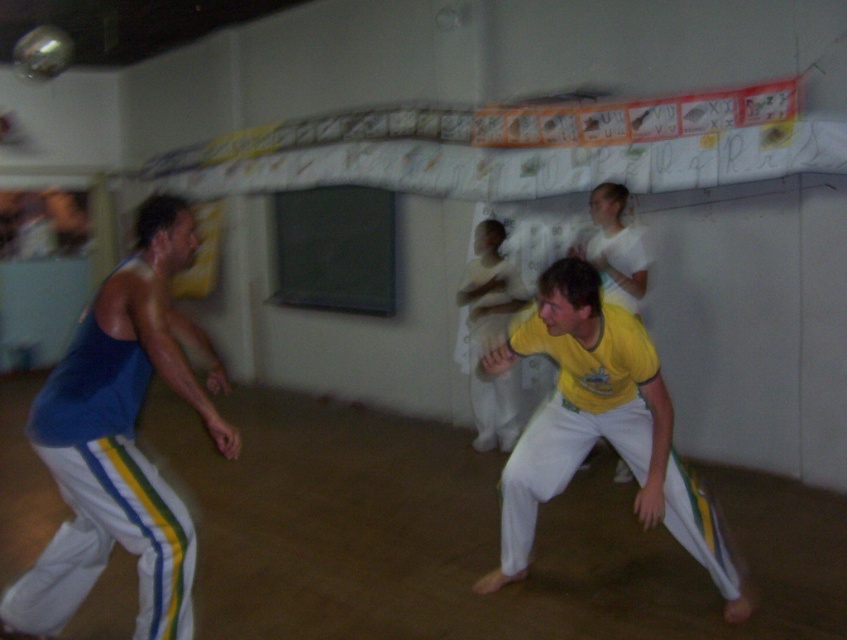
You are observing a martial arts training session from the doorway. You notice two points marked in the room. Which point is nearer to you, point [170,224] or point [524,500]?

Point [170,224] is closer to the viewer than point [524,500].